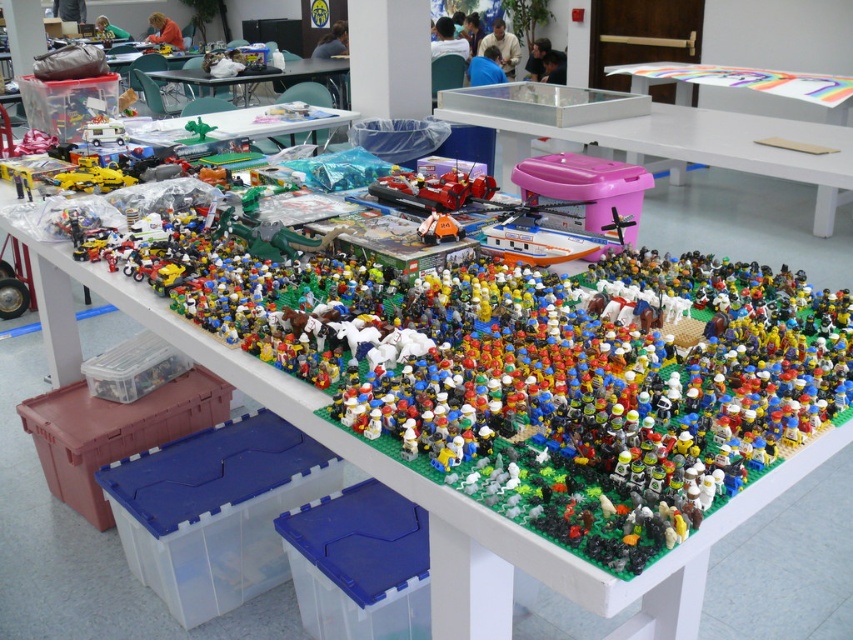
Identify the location of green plastic table at upper center. (242, 125).

Which is behind, point (225, 131) or point (328, 64)?

The point (328, 64) is more distant.

What do you see at coordinates (242, 125) in the screenshot? The height and width of the screenshot is (640, 853). I see `green plastic table at upper center` at bounding box center [242, 125].

Where is `green plastic table at upper center`? This screenshot has width=853, height=640. green plastic table at upper center is located at coordinates [242, 125].

Can you confirm if pink plastic bin at center is thinner than green plastic table at upper center?

Incorrect, pink plastic bin at center's width is not less than green plastic table at upper center's.

Is the position of pink plastic bin at center less distant than that of green plastic table at upper center?

Yes, pink plastic bin at center is closer to the viewer.

Locate an element on the screen. The image size is (853, 640). pink plastic bin at center is located at coordinates (659, 134).

Can you confirm if pink plastic bin at center is taller than matte plastic table at upper center?

Yes.

Locate an element on the screen. pink plastic bin at center is located at coordinates (659, 134).

Does point (564, 115) lie in front of point (345, 97)?

Yes, it is.

You are a GUI agent. You are given a task and a screenshot of the screen. Output one action in this format:
    pyautogui.click(x=<x>, y=<y>)
    Task: Click on the pink plastic bin at center
    The height and width of the screenshot is (640, 853).
    Given the screenshot: What is the action you would take?
    pyautogui.click(x=659, y=134)